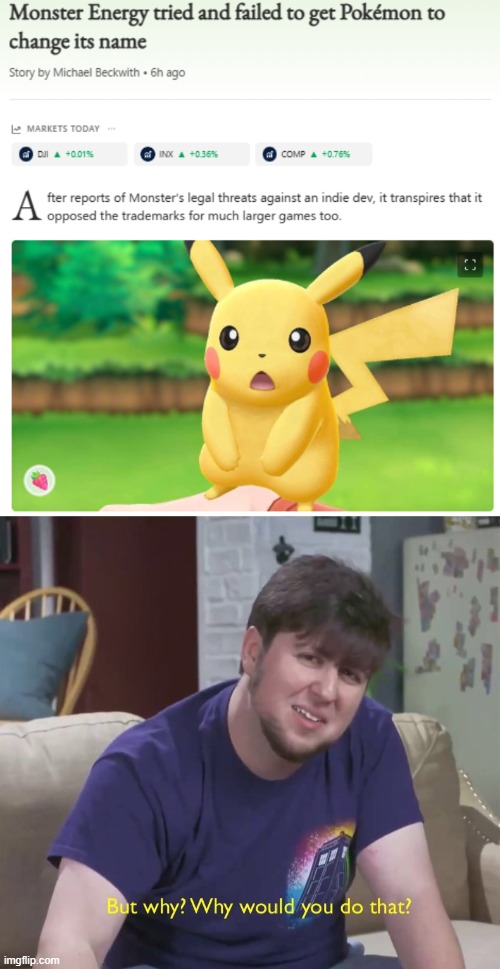
Where is `pillow`? Image resolution: width=500 pixels, height=969 pixels. pillow is located at coordinates (48, 647).